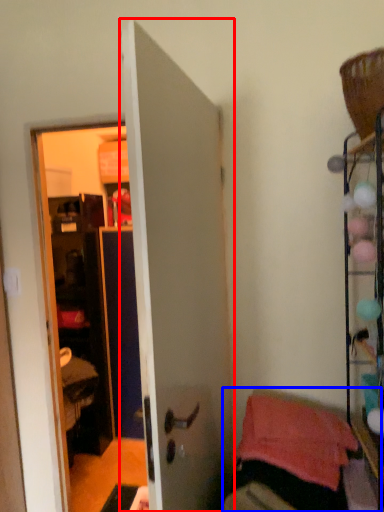
Question: Which object appears farthest to the camera in this image, door (highlighted by a red box) or furniture (highlighted by a blue box)?

Choices:
 (A) door
 (B) furniture

Answer: (B)